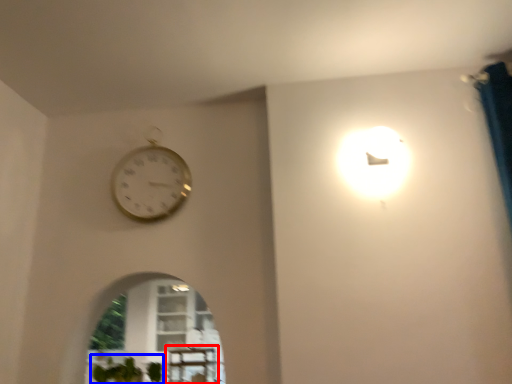
Question: Among these objects, which one is nearest to the camera, table (highlighted by a red box) or plant (highlighted by a blue box)?

Choices:
 (A) table
 (B) plant

Answer: (B)